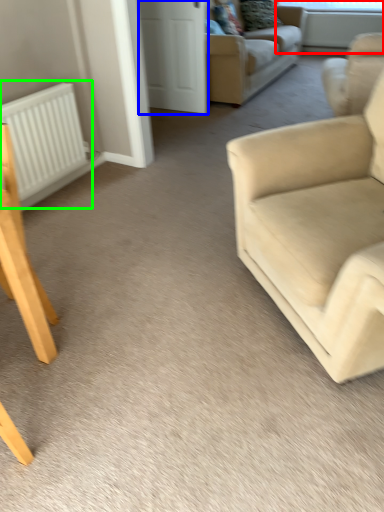
Question: Which object is positioned farthest from window screen (highlighted by a red box)? Select from glass door (highlighted by a blue box) and radiator (highlighted by a green box).

Choices:
 (A) glass door
 (B) radiator

Answer: (B)